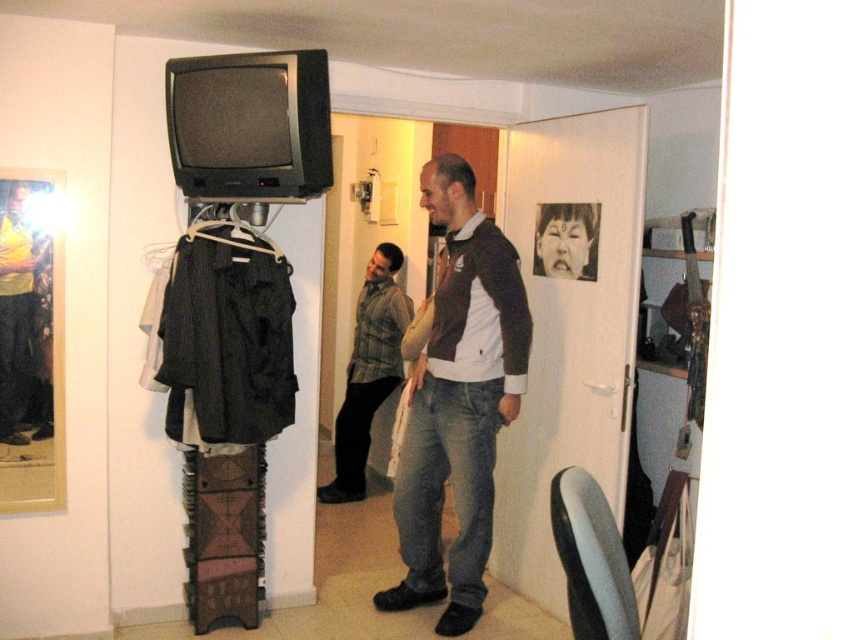
Looking at this image, can you confirm if black fabric hanger at left is wider than smooth black face at upper center?

Correct, the width of black fabric hanger at left exceeds that of smooth black face at upper center.

Which of these two, black fabric hanger at left or smooth black face at upper center, stands taller?

Standing taller between the two is smooth black face at upper center.

Identify the location of black fabric hanger at left. Image resolution: width=853 pixels, height=640 pixels. click(235, 227).

Can you confirm if brown/white sweater at center is bigger than plaid fabric shirt at center?

Indeed, brown/white sweater at center has a larger size compared to plaid fabric shirt at center.

From the picture: Can you confirm if brown/white sweater at center is thinner than plaid fabric shirt at center?

No, brown/white sweater at center is not thinner than plaid fabric shirt at center.

Does point (424, 554) come behind point (373, 280)?

No, (424, 554) is closer to viewer.

Image resolution: width=853 pixels, height=640 pixels. Identify the location of brown/white sweater at center. (457, 403).

Does plaid fabric shirt at center appear on the right side of smooth black face at upper center?

No, plaid fabric shirt at center is not to the right of smooth black face at upper center.

Which is in front, point (398, 253) or point (569, 216)?

Positioned in front is point (569, 216).

I want to click on plaid fabric shirt at center, so click(x=368, y=371).